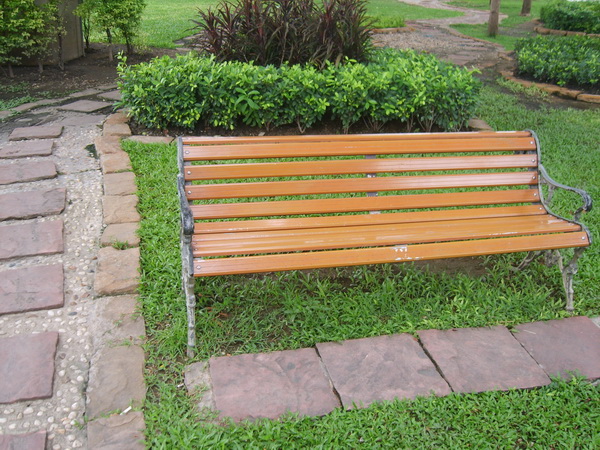
Identify the location of wood slats. This screenshot has width=600, height=450. click(224, 262), click(222, 246), click(219, 240), click(219, 227), click(219, 208), click(218, 185), click(218, 169), click(217, 150), click(214, 139).